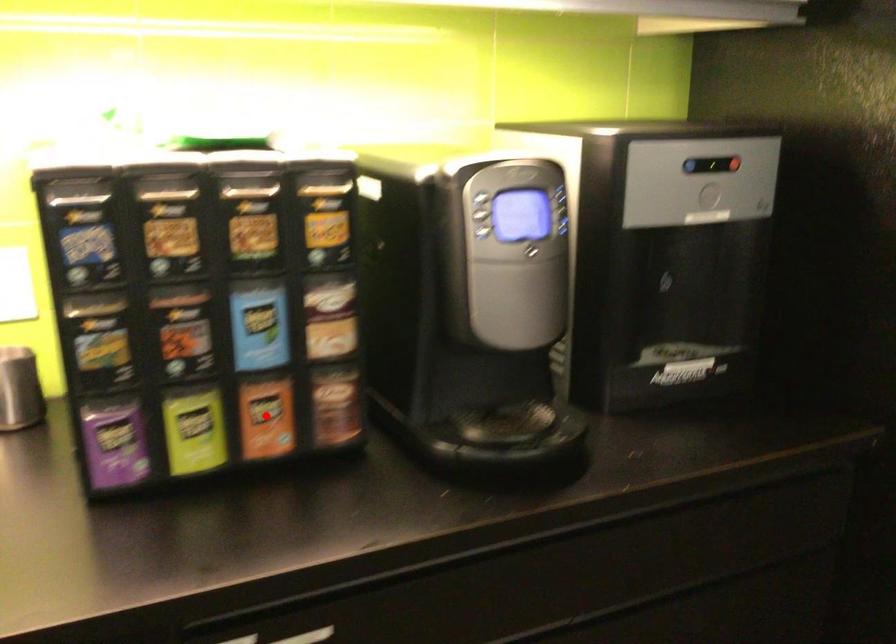
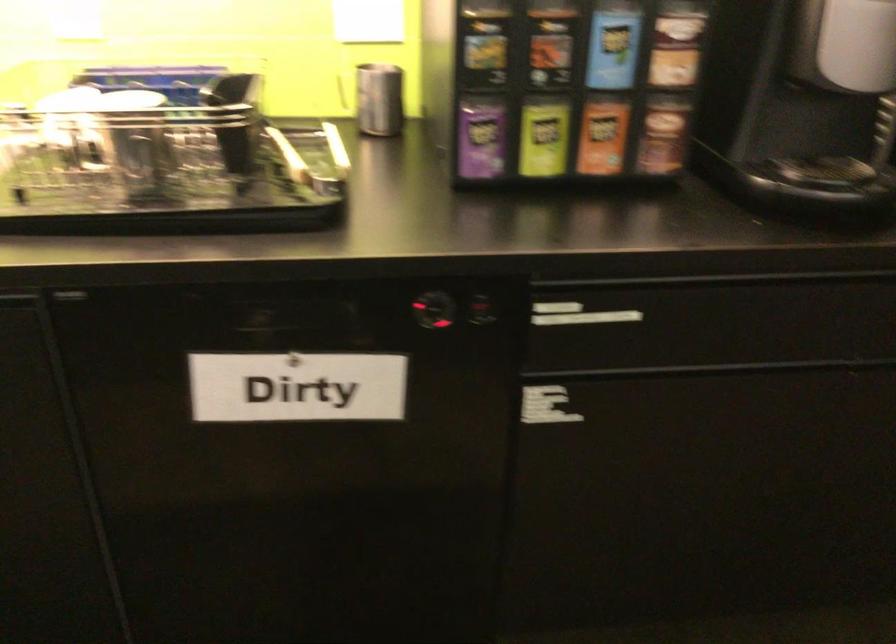
Question: I am providing you with two images of the same scene from different viewpoints. A red point is marked on the first image. Is the red point's position out of view in image 2?

Choices:
 (A) Yes
 (B) No

Answer: (B)